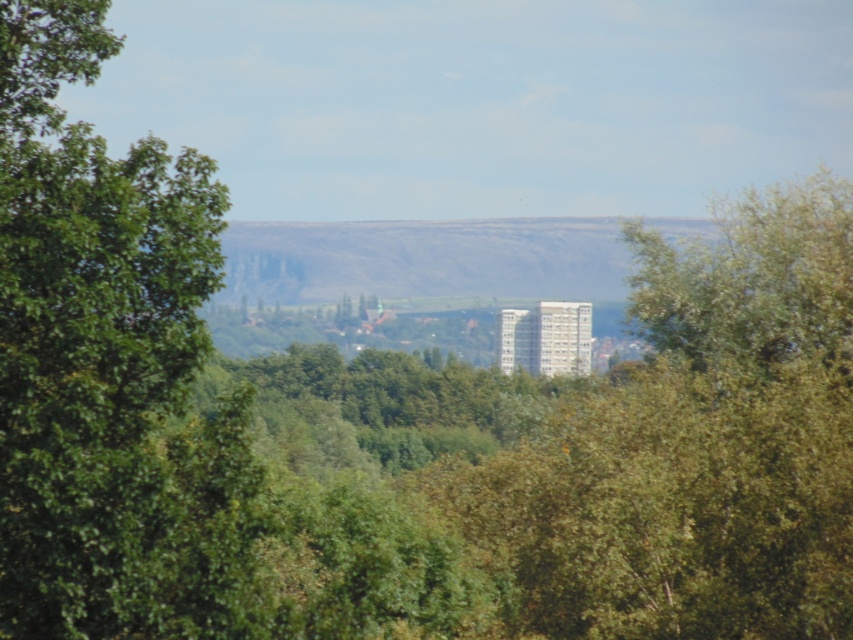
The height and width of the screenshot is (640, 853). I want to click on green leafy tree at left, so click(x=109, y=369).

Does green leafy tree at left appear under rocky cliff at center?

Yes, green leafy tree at left is below rocky cliff at center.

Does point (53, 252) come in front of point (248, 264)?

Yes, it is in front of point (248, 264).

Locate an element on the screen. The height and width of the screenshot is (640, 853). green leafy tree at left is located at coordinates (109, 369).